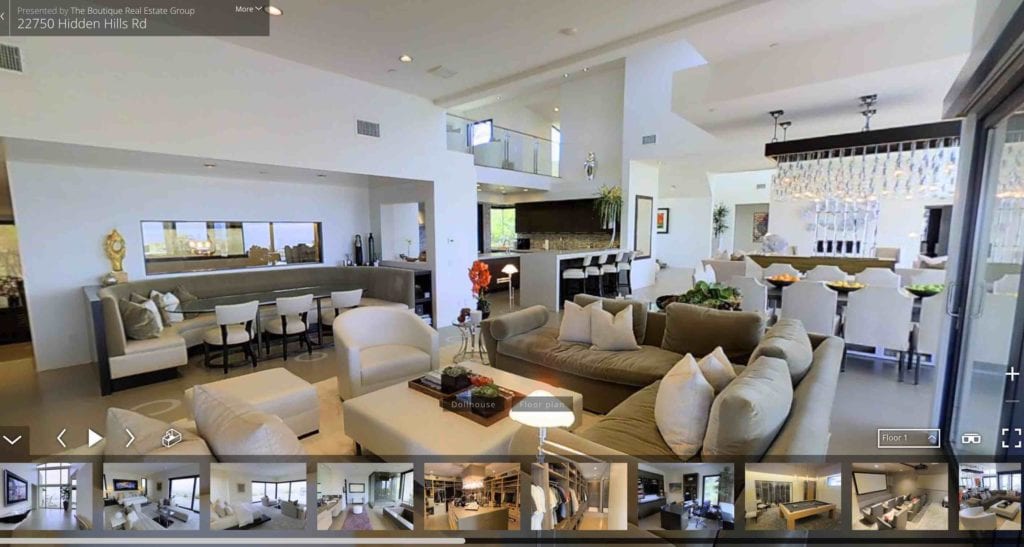
Locate an element on the screen. The width and height of the screenshot is (1024, 547). pillows is located at coordinates (720, 371).